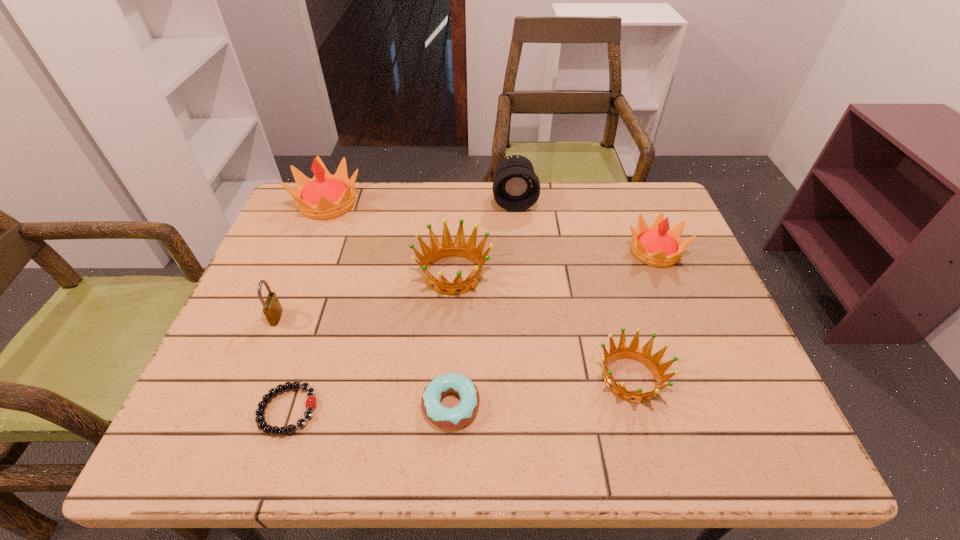
Locate an element on the screen. This screenshot has width=960, height=540. free space between the black bracelet and the doughnut is located at coordinates (370, 408).

Locate an element on the screen. object that stands as the sixth closest to the right golden crown is located at coordinates (272, 309).

Identify which object is the second closest to the third shortest object. Please provide its 2D coordinates. Your answer should be formatted as a tuple, i.e. [(x, y)], where the tuple contains the x and y coordinates of a point satisfying the conditions above.

[(447, 418)]

Identify which crown is the fourth closest to the padlock. Please provide its 2D coordinates. Your answer should be formatted as a tuple, i.e. [(x, y)], where the tuple contains the x and y coordinates of a point satisfying the conditions above.

[(657, 246)]

The height and width of the screenshot is (540, 960). In order to click on the closest crown to the blue doughnut in this screenshot , I will do `click(437, 251)`.

The width and height of the screenshot is (960, 540). Identify the location of blank space that satisfies the following two spatial constraints: 1. on the front side of the black bracelet; 2. on the left side of the fourth nearest object. (238, 410).

At what (x,y) coordinates should I click in order to perform the action: click on vacant space that satisfies the following two spatial constraints: 1. at the front element of the black telephoto lens; 2. on the right side of the rightmost object. Please return your answer as a coordinate pair (x, y). Looking at the image, I should click on (519, 252).